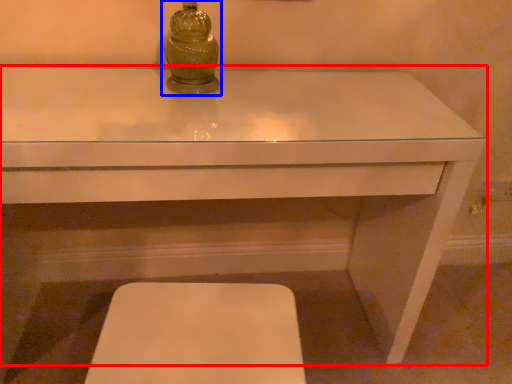
Question: Which point is further to the camera, table (highlighted by a red box) or candle holder (highlighted by a blue box)?

Choices:
 (A) table
 (B) candle holder

Answer: (B)